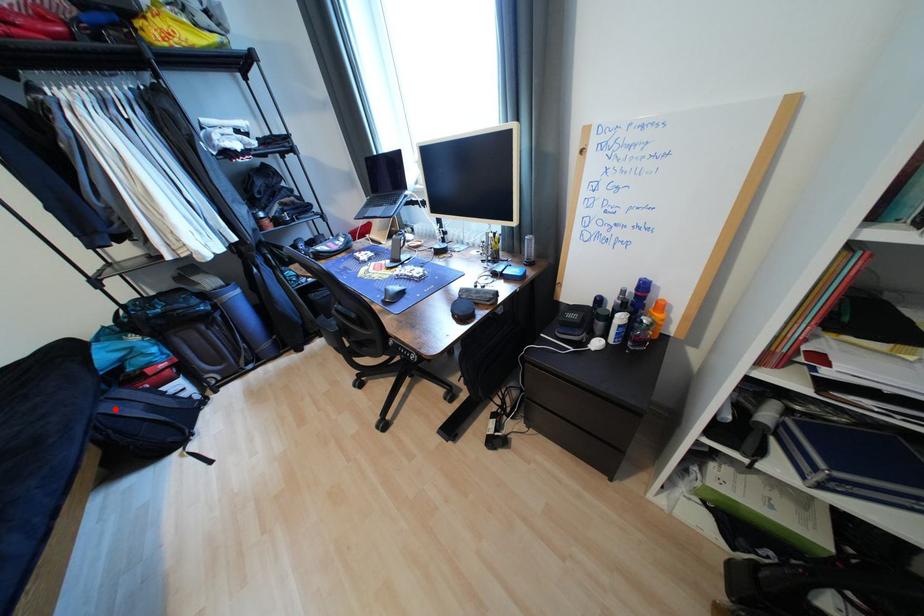
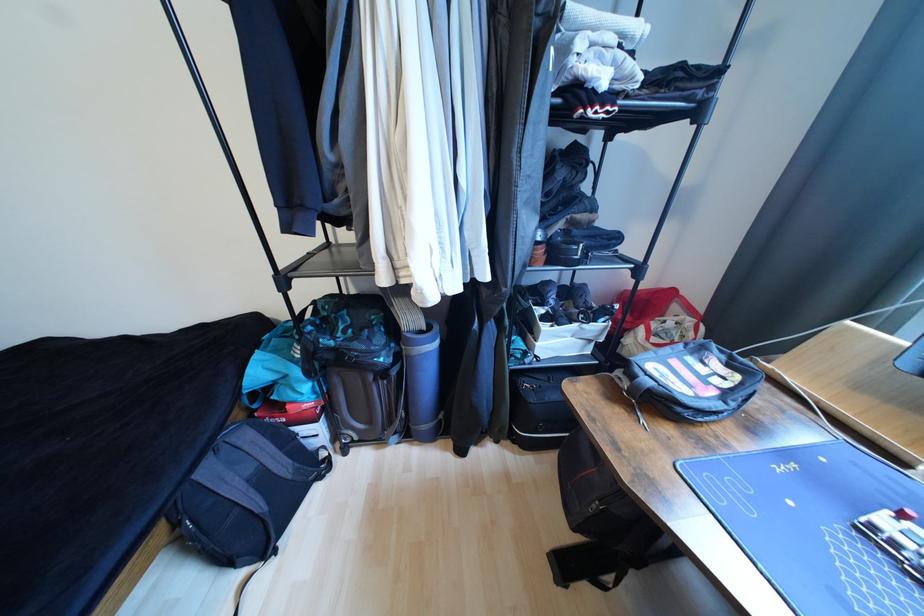
Locate, in the second image, the point that corresponds to the highlighted location in the first image.

(215, 472)